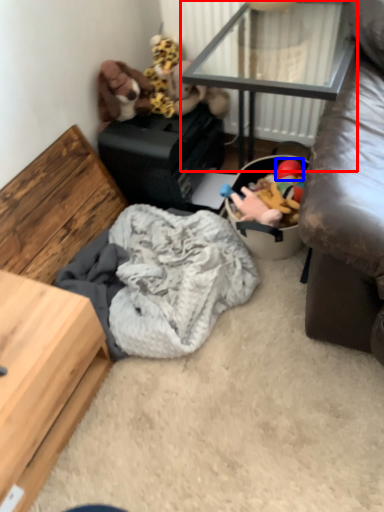
Question: Among these objects, which one is farthest to the camera, table (highlighted by a red box) or toy (highlighted by a blue box)?

Choices:
 (A) table
 (B) toy

Answer: (B)